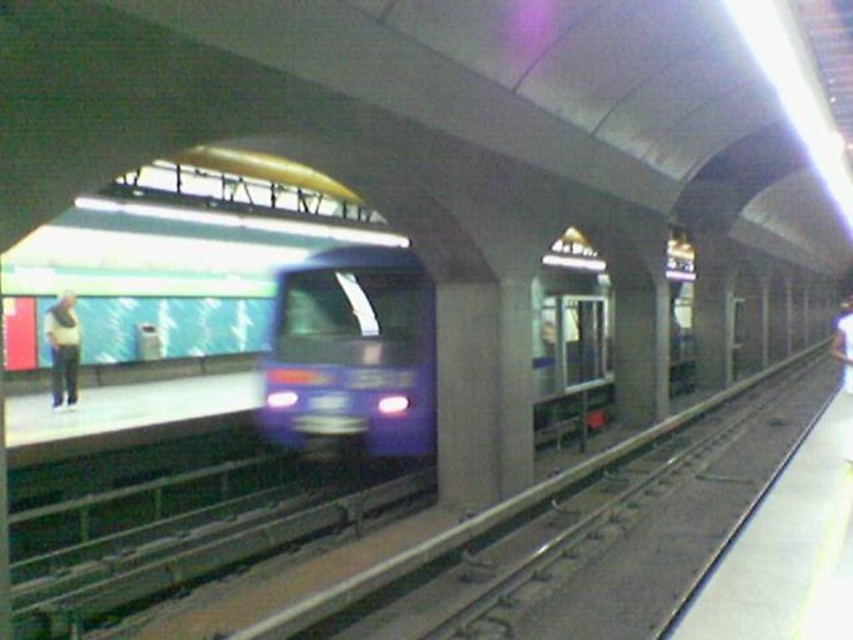
Does point (68, 353) lie in front of point (840, 332)?

No, (68, 353) is further to viewer.

Can you confirm if light brown leather jacket at left is positioned below white matte shirt at center?

No, light brown leather jacket at left is not below white matte shirt at center.

I want to click on light brown leather jacket at left, so click(62, 349).

How far apart are blue glossy train at center and white matte shirt at center?

blue glossy train at center and white matte shirt at center are 7.76 meters apart.

Can you confirm if blue glossy train at center is thinner than white matte shirt at center?

Indeed, blue glossy train at center has a lesser width compared to white matte shirt at center.

Who is more forward, (366,260) or (833,355)?

Point (366,260)

Identify the location of blue glossy train at center. This screenshot has height=640, width=853. (352, 355).

This screenshot has width=853, height=640. What do you see at coordinates (352, 355) in the screenshot? I see `blue glossy train at center` at bounding box center [352, 355].

Is blue glossy train at center shorter than light brown leather jacket at left?

No.

Locate an element on the screen. blue glossy train at center is located at coordinates (352, 355).